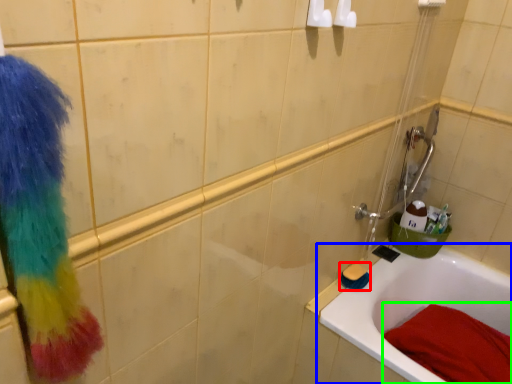
Question: Estimate the real-world distances between objects in this image. Which object is farther from brush (highlighted by a red box), bathtub (highlighted by a blue box) or bath towel (highlighted by a green box)?

Choices:
 (A) bathtub
 (B) bath towel

Answer: (B)